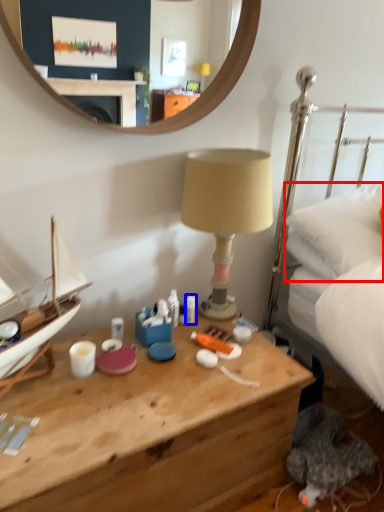
Question: Which object appears closest to the camera in this image, pillow (highlighted by a red box) or toiletry (highlighted by a blue box)?

Choices:
 (A) pillow
 (B) toiletry

Answer: (A)